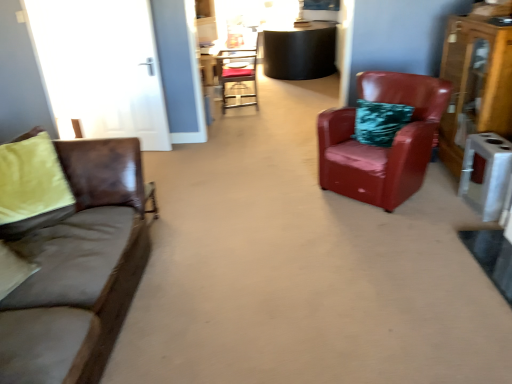
Question: Is leather armchair at right, which ranks as the second chair in left-to-right order, oriented towards wooden dresser at right?

Choices:
 (A) no
 (B) yes

Answer: (A)

Question: Is leather armchair at right, which ranks as the second chair in back-to-front order, far from wooden dresser at right?

Choices:
 (A) yes
 (B) no

Answer: (B)

Question: From a real-world perspective, is leather armchair at right, positioned as the 1th chair in bottom-to-top order, located beneath wooden dresser at right?

Choices:
 (A) yes
 (B) no

Answer: (A)

Question: Can you confirm if leather armchair at right, which ranks as the second chair in left-to-right order, is smaller than wooden dresser at right?

Choices:
 (A) no
 (B) yes

Answer: (A)

Question: From the image's perspective, is leather armchair at right, which ranks as the second chair in left-to-right order, above wooden dresser at right?

Choices:
 (A) no
 (B) yes

Answer: (A)

Question: Can you confirm if leather armchair at right, which is counted as the first chair, starting from the front, is positioned to the right of wooden dresser at right?

Choices:
 (A) yes
 (B) no

Answer: (B)

Question: Is wooden dresser at right wider than leather armchair at right, which ranks as the second chair in left-to-right order?

Choices:
 (A) yes
 (B) no

Answer: (B)

Question: Is the position of wooden dresser at right more distant than that of leather armchair at right, which is the first chair in right-to-left order?

Choices:
 (A) no
 (B) yes

Answer: (B)

Question: Would you say wooden dresser at right is a long distance from leather armchair at right, which ranks as the second chair in left-to-right order?

Choices:
 (A) yes
 (B) no

Answer: (B)

Question: Could you tell me if wooden dresser at right is turned towards leather armchair at right, which ranks as the second chair in back-to-front order?

Choices:
 (A) yes
 (B) no

Answer: (A)

Question: Is the depth of wooden dresser at right less than that of leather armchair at right, which is counted as the first chair, starting from the front?

Choices:
 (A) no
 (B) yes

Answer: (A)

Question: Can you confirm if wooden dresser at right is smaller than leather armchair at right, which is the 2th chair from top to bottom?

Choices:
 (A) yes
 (B) no

Answer: (A)

Question: Is brown leather couch at left behind wooden dresser at right?

Choices:
 (A) yes
 (B) no

Answer: (B)